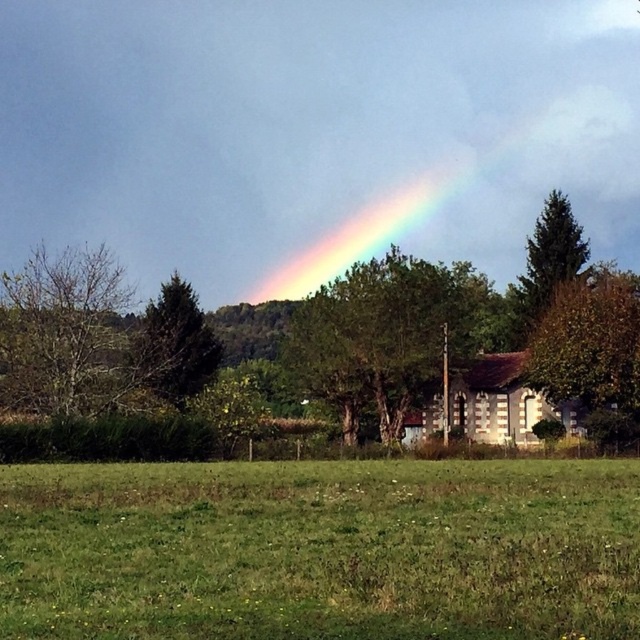
Question: Is green grass at lower center wider than bare branches at left?

Choices:
 (A) no
 (B) yes

Answer: (A)

Question: Which of the following is the closest to the observer?

Choices:
 (A) green leafy tree at center
 (B) rainbow at upper center
 (C) green matte tree at upper right
 (D) brown textured tree at right

Answer: (D)

Question: Is green grass at lower center to the right of rainbow at upper center from the viewer's perspective?

Choices:
 (A) no
 (B) yes

Answer: (A)

Question: Among these objects, which one is farthest from the camera?

Choices:
 (A) brown textured tree at right
 (B) rainbow at upper center

Answer: (B)

Question: Which object appears closest to the camera in this image?

Choices:
 (A) green matte tree at left
 (B) bare branches at left
 (C) rainbow at upper center
 (D) green matte tree at upper right

Answer: (B)

Question: Does brown textured tree at right have a greater width compared to green matte tree at upper right?

Choices:
 (A) yes
 (B) no

Answer: (A)